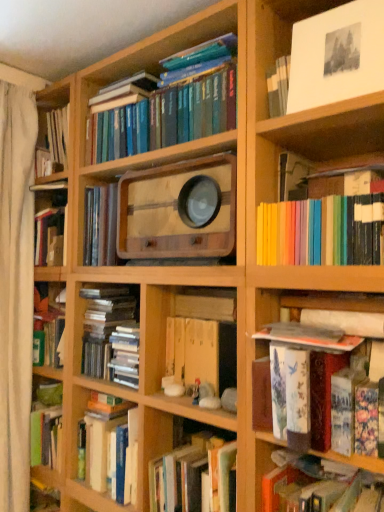
Question: Considering the relative positions of hardcover book at lower right, which is the 5th book from top to bottom, and white paper at upper right in the image provided, is hardcover book at lower right, which is the 5th book from top to bottom, to the left of white paper at upper right from the viewer's perspective?

Choices:
 (A) yes
 (B) no

Answer: (A)

Question: Is hardcover book at lower right, which is the 5th book from top to bottom, taller than white paper at upper right?

Choices:
 (A) yes
 (B) no

Answer: (B)

Question: Does hardcover book at lower right, acting as the first book starting from the bottom, have a smaller size compared to white paper at upper right?

Choices:
 (A) yes
 (B) no

Answer: (B)

Question: Is hardcover book at lower right, acting as the first book starting from the bottom, directly adjacent to white paper at upper right?

Choices:
 (A) yes
 (B) no

Answer: (B)

Question: Is hardcover book at lower right, which is the 5th book from top to bottom, bigger than white paper at upper right?

Choices:
 (A) no
 (B) yes

Answer: (B)

Question: From a real-world perspective, relative to white paper at upper right, is rainbow-colored paper at upper right, the third book in the bottom-to-top sequence, vertically above or below?

Choices:
 (A) above
 (B) below

Answer: (B)

Question: Is point (304, 250) positioned closer to the camera than point (379, 31)?

Choices:
 (A) closer
 (B) farther

Answer: (B)

Question: Relative to white paper at upper right, is rainbow-colored paper at upper right, the third book in the bottom-to-top sequence, in front or behind?

Choices:
 (A) front
 (B) behind

Answer: (A)

Question: Is rainbow-colored paper at upper right, marked as the third book in a top-to-bottom arrangement, to the left or to the right of white paper at upper right in the image?

Choices:
 (A) left
 (B) right

Answer: (B)

Question: Is point (14, 412) positioned closer to the camera than point (296, 108)?

Choices:
 (A) farther
 (B) closer

Answer: (A)

Question: Choose the correct answer: Is white fabric curtain at left inside white paper at upper right or outside it?

Choices:
 (A) inside
 (B) outside

Answer: (B)

Question: From the image's perspective, is white fabric curtain at left positioned above or below white paper at upper right?

Choices:
 (A) above
 (B) below

Answer: (B)

Question: From a real-world perspective, is white fabric curtain at left above or below white paper at upper right?

Choices:
 (A) below
 (B) above

Answer: (A)

Question: From a real-world perspective, is hardcover book at lower right, which is the 5th book from top to bottom, above or below white paper at upper right?

Choices:
 (A) above
 (B) below

Answer: (B)

Question: Considering their positions, is hardcover book at lower right, which is the 5th book from top to bottom, located in front of or behind white paper at upper right?

Choices:
 (A) front
 (B) behind

Answer: (A)